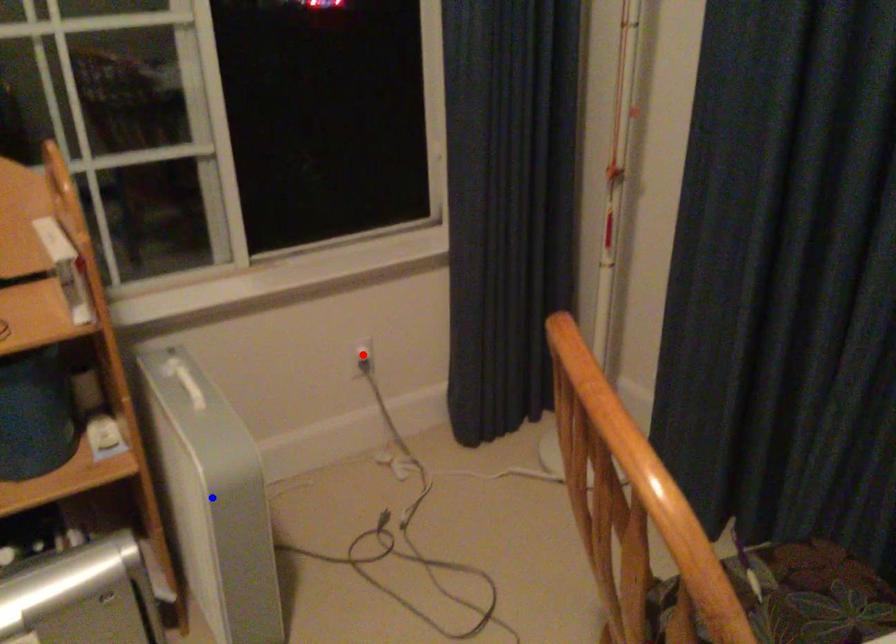
Question: In the image, two points are highlighted. Which point is nearer to the camera? Reply with the corresponding letter.

Choices:
 (A) blue point
 (B) red point

Answer: (A)